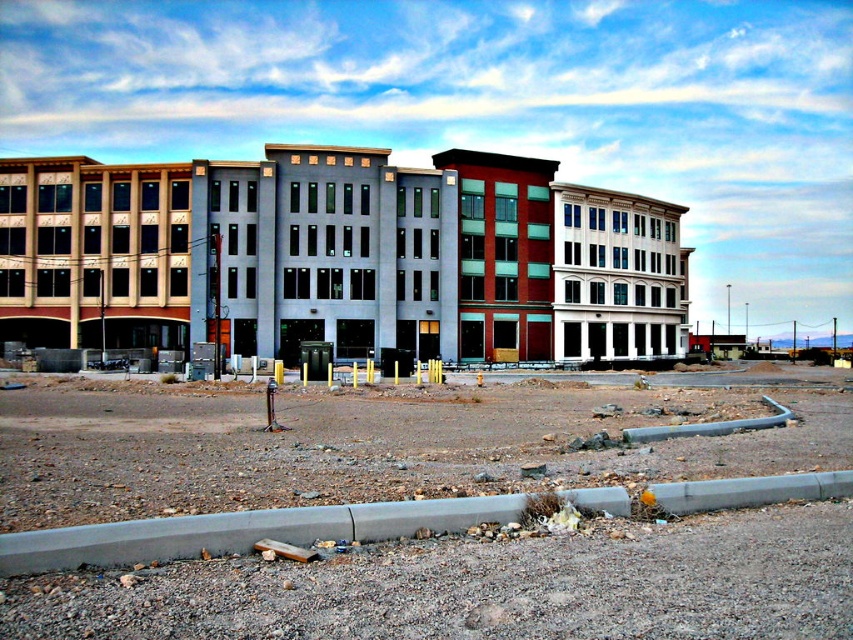
Who is lower down, brown gravel dirt field at lower center or matte gray building at center?

brown gravel dirt field at lower center is below.

The height and width of the screenshot is (640, 853). I want to click on brown gravel dirt field at lower center, so tap(485, 588).

At what (x,y) coordinates should I click in order to perform the action: click on brown gravel dirt field at lower center. Please return your answer as a coordinate pair (x, y). The image size is (853, 640). Looking at the image, I should click on (485, 588).